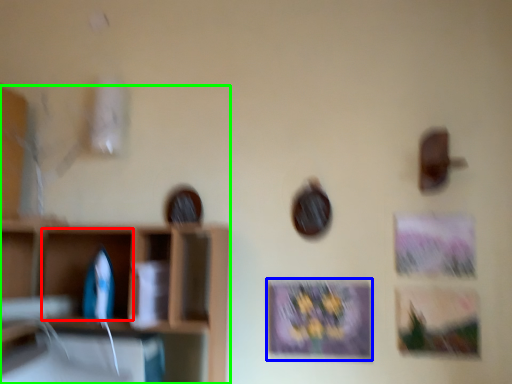
Question: Which object is the farthest from cabinet (highlighted by a red box)? Choose among these: picture frame (highlighted by a blue box) or shelf (highlighted by a green box).

Choices:
 (A) picture frame
 (B) shelf

Answer: (A)